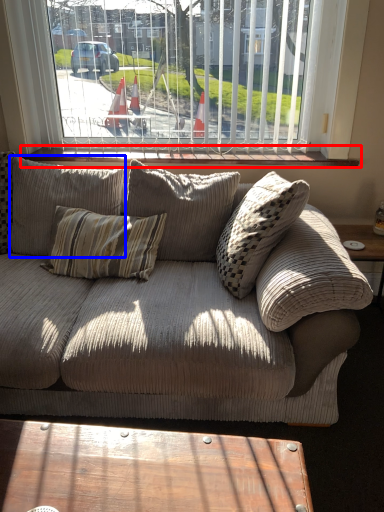
Question: Among these objects, which one is farthest to the camera, window sill (highlighted by a red box) or pillow (highlighted by a blue box)?

Choices:
 (A) window sill
 (B) pillow

Answer: (A)